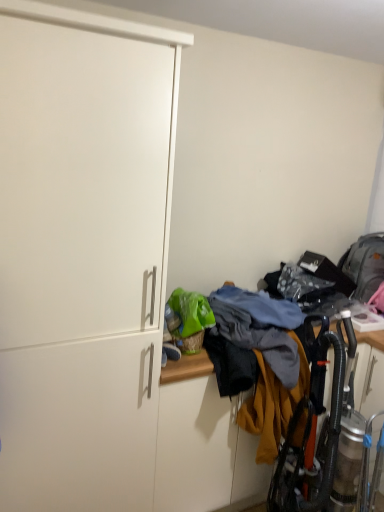
Question: Considering the positions of point (13, 165) and point (382, 230), is point (13, 165) closer or farther from the camera than point (382, 230)?

Choices:
 (A) farther
 (B) closer

Answer: (B)

Question: From the image's perspective, is white matte cabinet at left above or below multicolored fabric at lower right?

Choices:
 (A) above
 (B) below

Answer: (A)

Question: Looking at their shapes, would you say white matte cabinet at left is wider or thinner than multicolored fabric at lower right?

Choices:
 (A) thin
 (B) wide

Answer: (A)

Question: Is multicolored fabric at lower right spatially inside white matte cabinet at left, or outside of it?

Choices:
 (A) outside
 (B) inside

Answer: (A)

Question: From the image's perspective, is multicolored fabric at lower right above or below white matte cabinet at left?

Choices:
 (A) above
 (B) below

Answer: (B)

Question: Considering the positions of multicolored fabric at lower right and white matte cabinet at left in the image, is multicolored fabric at lower right bigger or smaller than white matte cabinet at left?

Choices:
 (A) big
 (B) small

Answer: (B)

Question: From a real-world perspective, is multicolored fabric at lower right above or below white matte cabinet at left?

Choices:
 (A) above
 (B) below

Answer: (B)